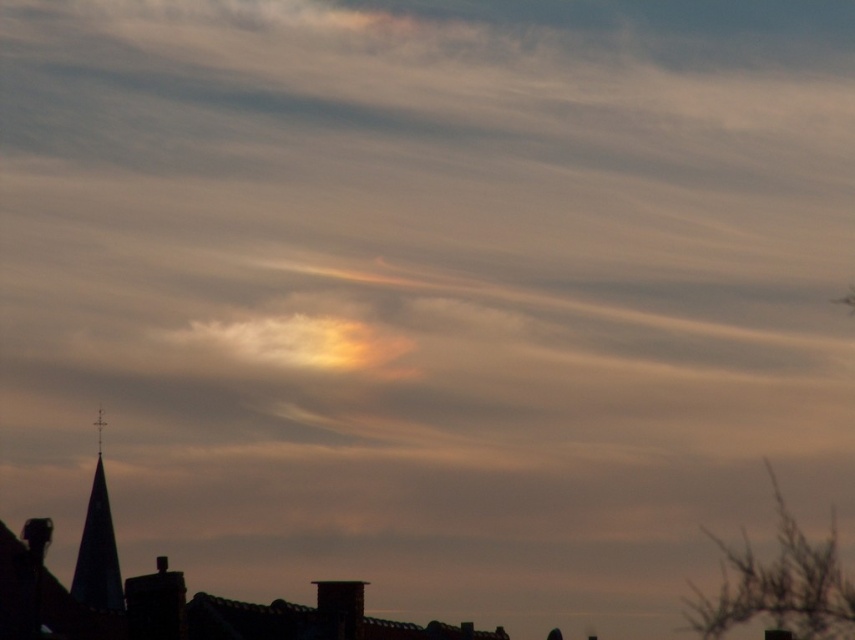
How much distance is there between golden translucent cloud at center and dark gray stone spire at lower left?

golden translucent cloud at center and dark gray stone spire at lower left are 715.98 feet apart from each other.

How much distance is there between golden translucent cloud at center and dark gray stone spire at lower left?

Answer: They are 218.23 meters apart.

This screenshot has width=855, height=640. I want to click on golden translucent cloud at center, so click(302, 342).